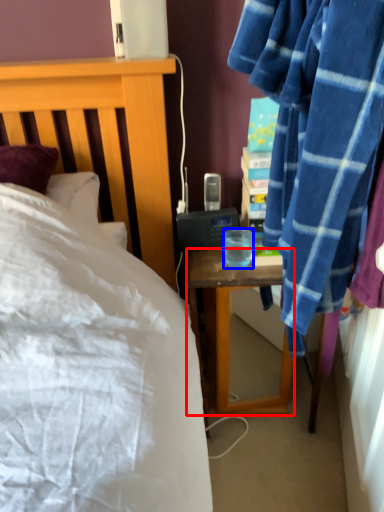
Question: Among these objects, which one is nearest to the camera, desk (highlighted by a red box) or coffee cup (highlighted by a blue box)?

Choices:
 (A) desk
 (B) coffee cup

Answer: (B)